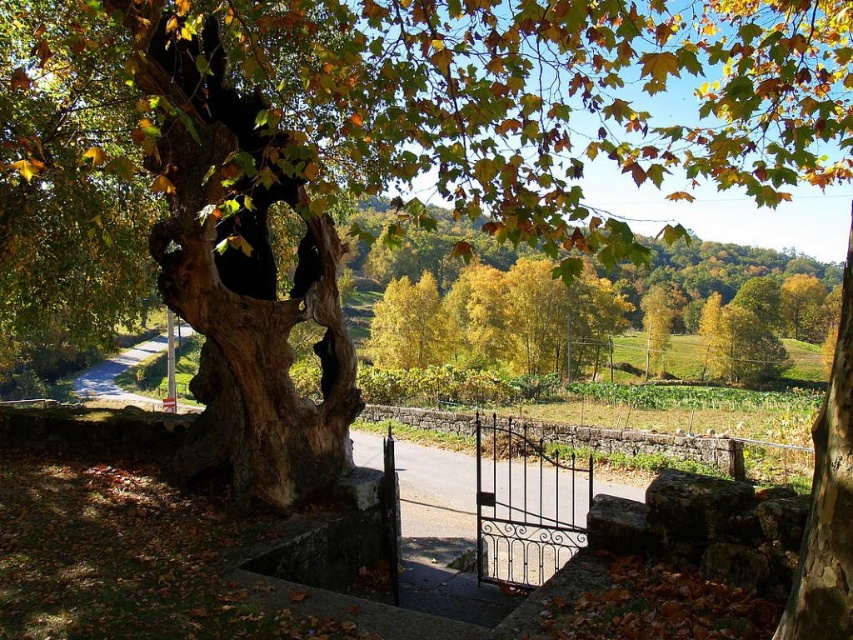
Who is shorter, yellow-green leaves at center or brown rough bark at center?

brown rough bark at center

Is yellow-green leaves at center in front of brown rough bark at center?

No, it is behind brown rough bark at center.

What do you see at coordinates (747, 289) in the screenshot? I see `yellow-green leaves at center` at bounding box center [747, 289].

You are a GUI agent. You are given a task and a screenshot of the screen. Output one action in this format:
    pyautogui.click(x=<x>, y=<y>)
    Task: Click on the yellow-green leaves at center
    The height and width of the screenshot is (640, 853).
    Given the screenshot: What is the action you would take?
    pyautogui.click(x=747, y=289)

Does black wrought iron gate at center have a greater height compared to brown rough bark at center?

No, black wrought iron gate at center is not taller than brown rough bark at center.

Looking at this image, can you confirm if black wrought iron gate at center is positioned to the left of brown rough bark at center?

Yes, black wrought iron gate at center is to the left of brown rough bark at center.

This screenshot has width=853, height=640. I want to click on black wrought iron gate at center, so click(x=549, y=477).

Measure the distance between black wrought iron gate at center and yellow-green leaves at center.

A distance of 48.35 meters exists between black wrought iron gate at center and yellow-green leaves at center.

Between point (668, 451) and point (672, 248), which one is positioned in front?

Positioned in front is point (668, 451).

Does point (535, 545) come behind point (416, 257)?

No, (535, 545) is closer to viewer.

Find the location of `black wrought iron gate at center`. black wrought iron gate at center is located at coordinates (549, 477).